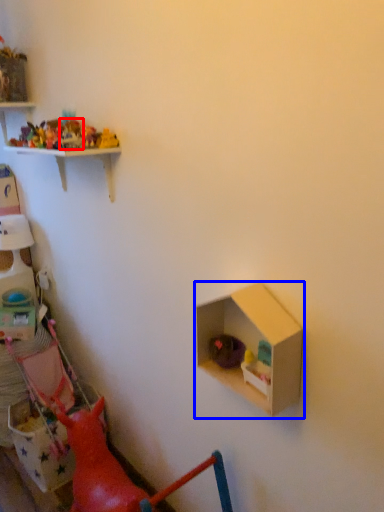
Question: Which point is closer to the camera, toy (highlighted by a red box) or shelf (highlighted by a blue box)?

Choices:
 (A) toy
 (B) shelf

Answer: (B)